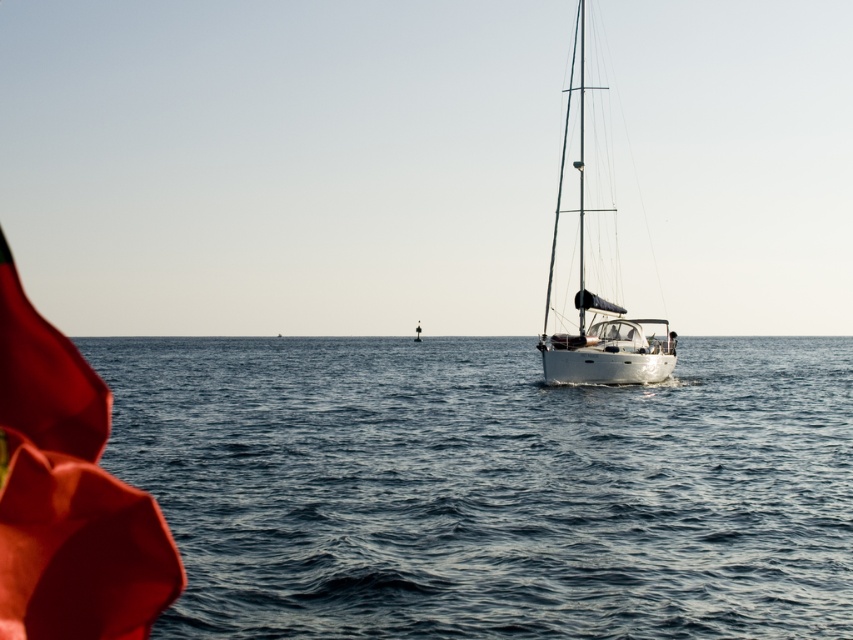
Between blue water at lower left and white glossy sailboat at center, which one has less height?

Standing shorter between the two is blue water at lower left.

Does point (697, 460) lie in front of point (582, 291)?

Yes.

You are a GUI agent. You are given a task and a screenshot of the screen. Output one action in this format:
    pyautogui.click(x=<x>, y=<y>)
    Task: Click on the blue water at lower left
    
    Given the screenshot: What is the action you would take?
    pyautogui.click(x=490, y=486)